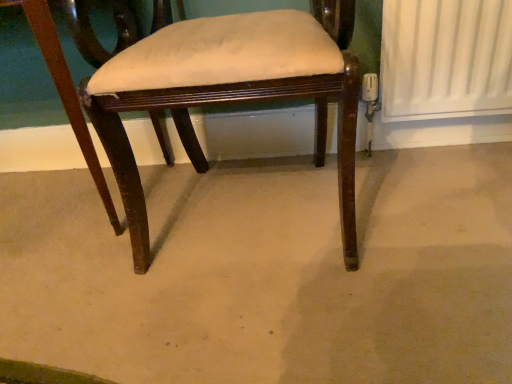
Question: Should I look upward or downward to see brown wood chair at center?

Choices:
 (A) up
 (B) down

Answer: (B)

Question: Is brown wood chair at center oriented towards mahogany wood chair at center?

Choices:
 (A) no
 (B) yes

Answer: (A)

Question: Is brown wood chair at center not inside mahogany wood chair at center?

Choices:
 (A) yes
 (B) no

Answer: (A)

Question: From the image's perspective, would you say brown wood chair at center is positioned over mahogany wood chair at center?

Choices:
 (A) yes
 (B) no

Answer: (B)

Question: Is brown wood chair at center thinner than mahogany wood chair at center?

Choices:
 (A) no
 (B) yes

Answer: (A)

Question: From a real-world perspective, is brown wood chair at center positioned under mahogany wood chair at center based on gravity?

Choices:
 (A) no
 (B) yes

Answer: (B)

Question: Considering the relative sizes of brown wood chair at center and mahogany wood chair at center in the image provided, is brown wood chair at center wider than mahogany wood chair at center?

Choices:
 (A) no
 (B) yes

Answer: (B)

Question: Is mahogany wood chair at center in front of brown wood chair at center?

Choices:
 (A) no
 (B) yes

Answer: (A)

Question: Does mahogany wood chair at center have a greater height compared to brown wood chair at center?

Choices:
 (A) yes
 (B) no

Answer: (A)

Question: Is brown wood chair at center located within mahogany wood chair at center?

Choices:
 (A) yes
 (B) no

Answer: (B)

Question: Is mahogany wood chair at center outside brown wood chair at center?

Choices:
 (A) no
 (B) yes

Answer: (B)

Question: Is mahogany wood chair at center positioned with its back to brown wood chair at center?

Choices:
 (A) yes
 (B) no

Answer: (B)

Question: Can you confirm if mahogany wood chair at center is positioned to the left of brown wood chair at center?

Choices:
 (A) yes
 (B) no

Answer: (B)

Question: Is point (258, 200) closer or farther from the camera than point (193, 104)?

Choices:
 (A) closer
 (B) farther

Answer: (B)